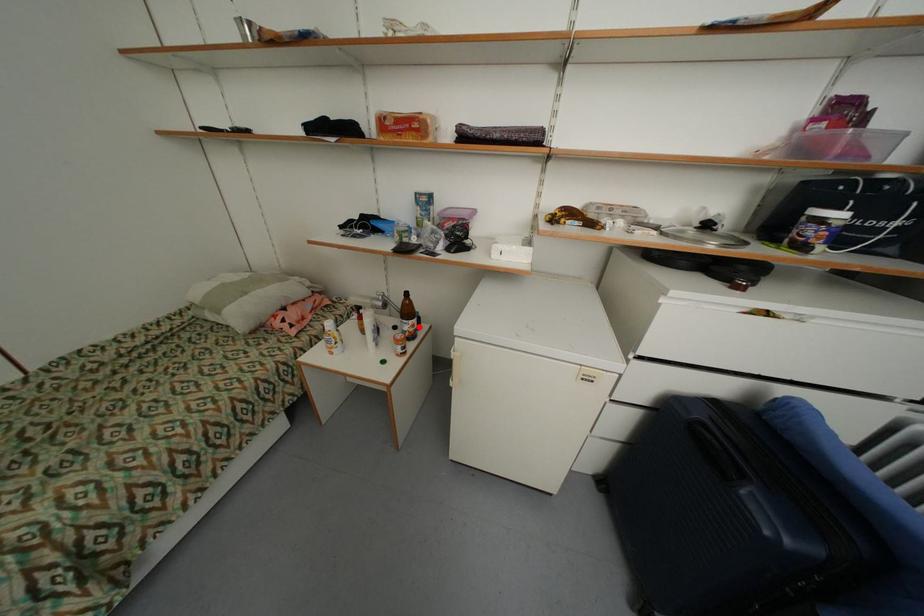
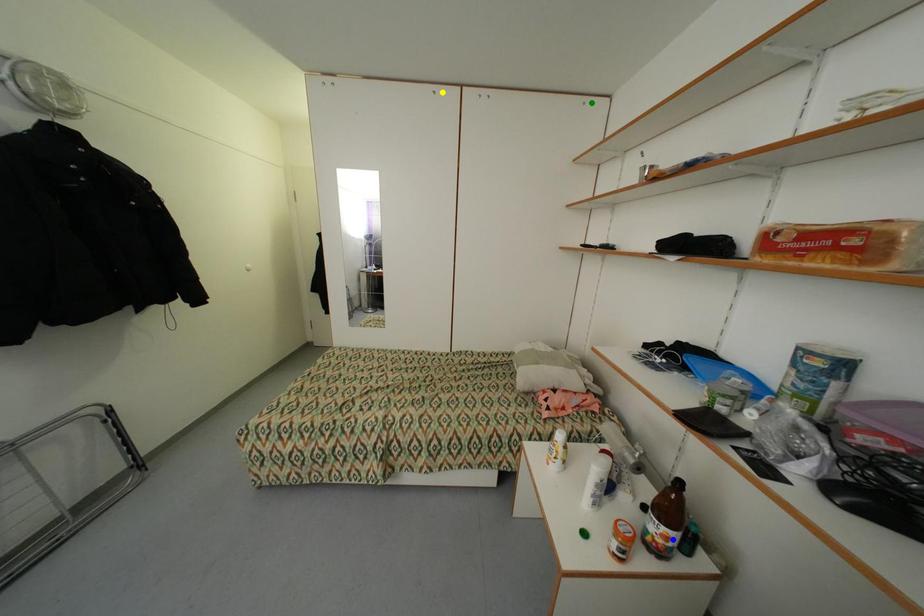
Question: I am providing you with two images of the same scene from different viewpoints. A red point is marked on the first image. You are given multiple points on the second image. Which point in image 2 represents the same 3d spot as the red point in image 1?

Choices:
 (A) green point
 (B) blue point
 (C) yellow point

Answer: (B)